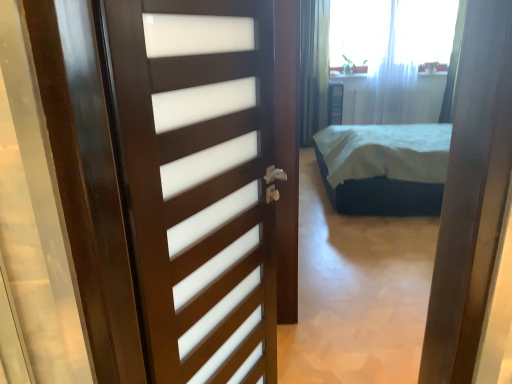
Question: Is white sheer curtain at upper center, arranged as the first curtain when viewed from the left, wider or thinner than white sheer curtain at upper right, acting as the 1th curtain starting from the right?

Choices:
 (A) wide
 (B) thin

Answer: (A)

Question: From a real-world perspective, is white sheer curtain at upper center, arranged as the first curtain when viewed from the left, positioned above or below white sheer curtain at upper right, the second curtain viewed from the left?

Choices:
 (A) below
 (B) above

Answer: (B)

Question: Which is nearer to the white sheer curtain at upper center, arranged as the first curtain when viewed from the left?

Choices:
 (A) dark blue fabric bed at center
 (B) dark wood door at center
 (C) white sheer curtain at upper right, acting as the 1th curtain starting from the right
 (D) white sheer curtain at upper center

Answer: (D)

Question: Estimate the real-world distances between objects in this image. Which object is farther from the white sheer curtain at upper center?

Choices:
 (A) dark blue fabric bed at center
 (B) white sheer curtain at upper right, acting as the 1th curtain starting from the right
 (C) white sheer curtain at upper center, placed as the second curtain when sorted from right to left
 (D) dark wood door at center

Answer: (D)